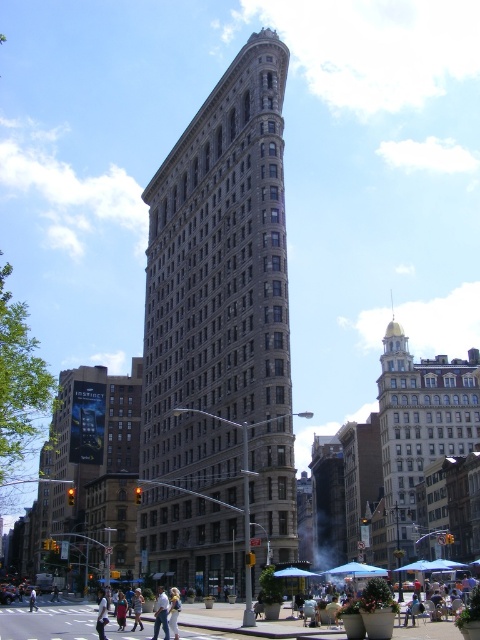
Question: Which object is the closest to the white cotton shirt at lower center?

Choices:
 (A) green fabric shirt at center
 (B) brown stone building at center

Answer: (A)

Question: Can you confirm if brown stone building at center is bigger than green fabric shirt at center?

Choices:
 (A) yes
 (B) no

Answer: (A)

Question: Is gold domed building at upper right below white cotton shirt at lower center?

Choices:
 (A) yes
 (B) no

Answer: (B)

Question: Which point appears closest to the camera in this image?

Choices:
 (A) (104, 621)
 (B) (180, 182)
 (C) (120, 593)
 (D) (29, 609)

Answer: (A)

Question: Which is nearer to the brown stone building at center?

Choices:
 (A) gold domed building at upper right
 (B) light blue jeans at lower center
 (C) light blue denim jeans at center
 (D) white cotton shirt at lower center

Answer: (B)

Question: Is brown stone billboard at left below gold domed building at upper right?

Choices:
 (A) no
 (B) yes

Answer: (B)